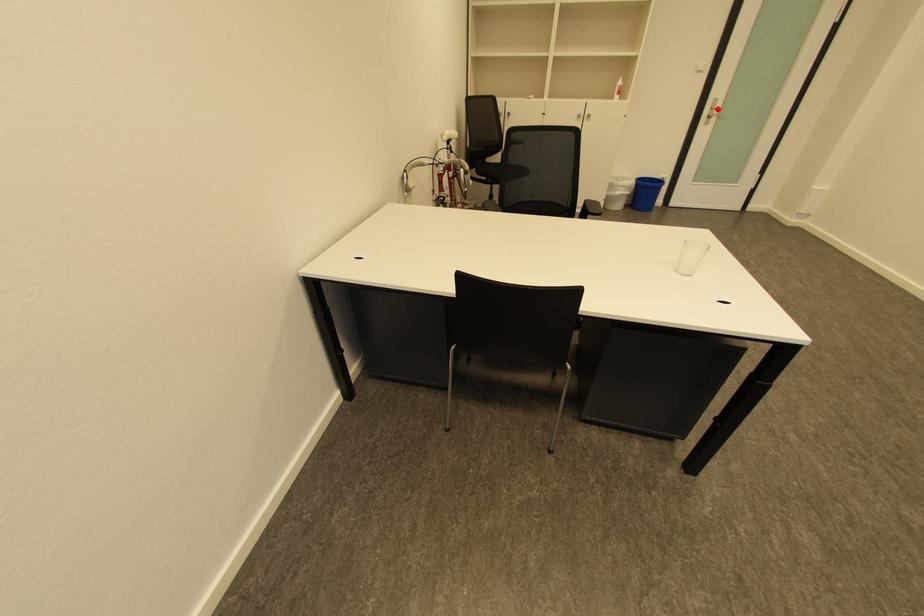
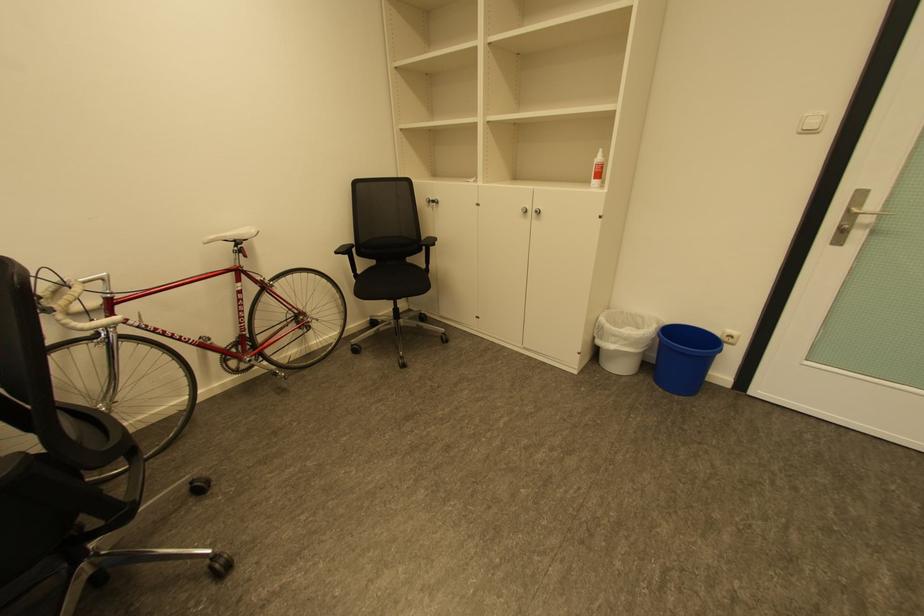
Where in the second image is the point corresponding to the highlighted location from the first image?

(855, 211)